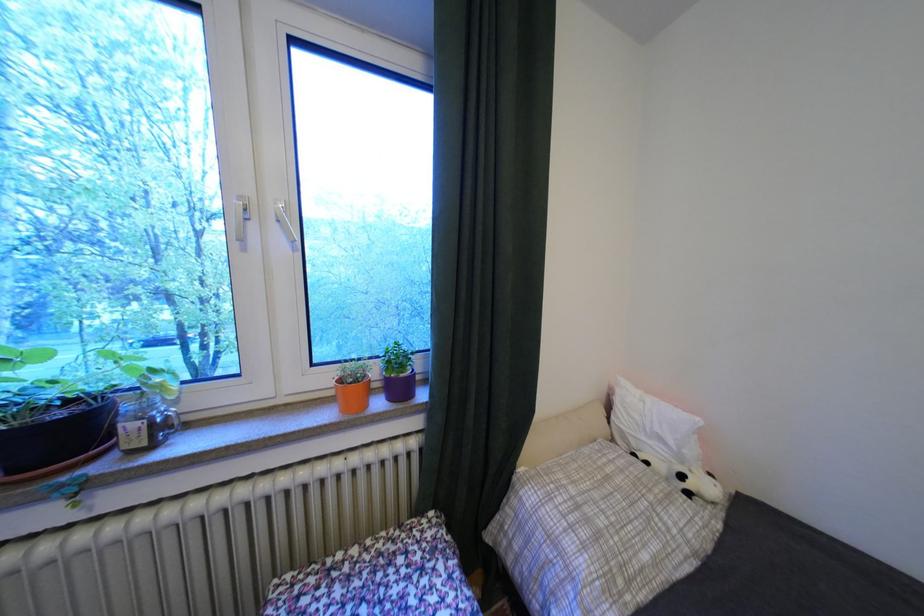
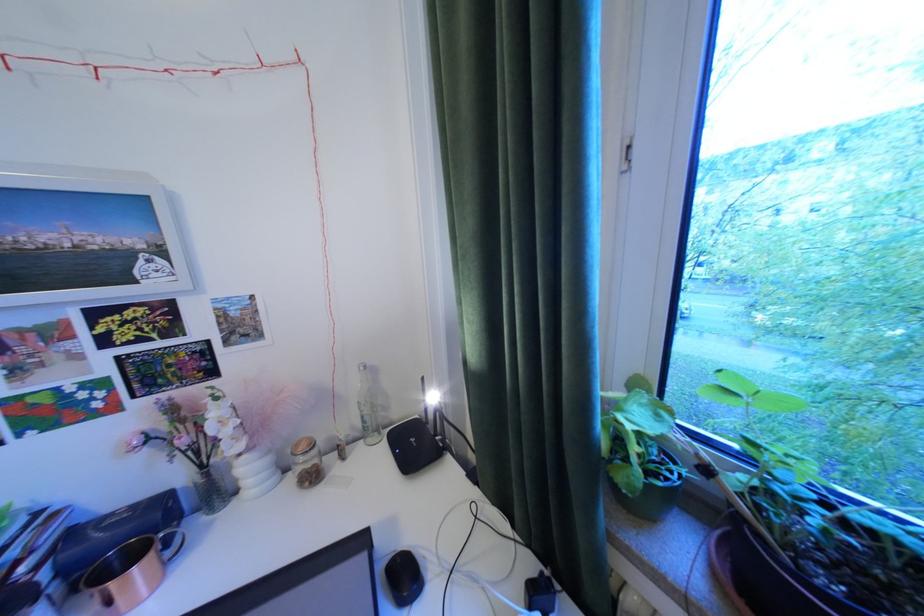
Question: How did the camera likely rotate?

Choices:
 (A) Left
 (B) Right
 (C) Up
 (D) Down

Answer: (A)